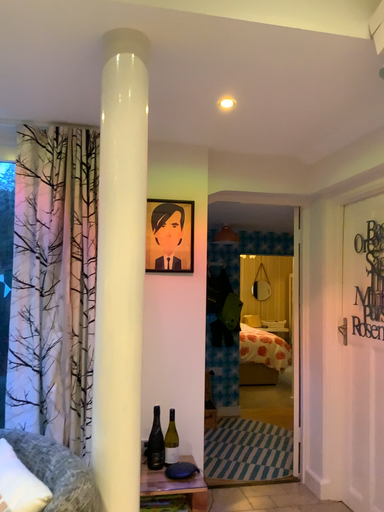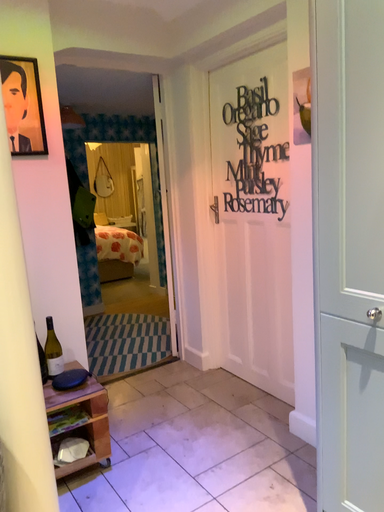
Question: How did the camera likely rotate when shooting the video?

Choices:
 (A) rotated right
 (B) rotated left

Answer: (A)